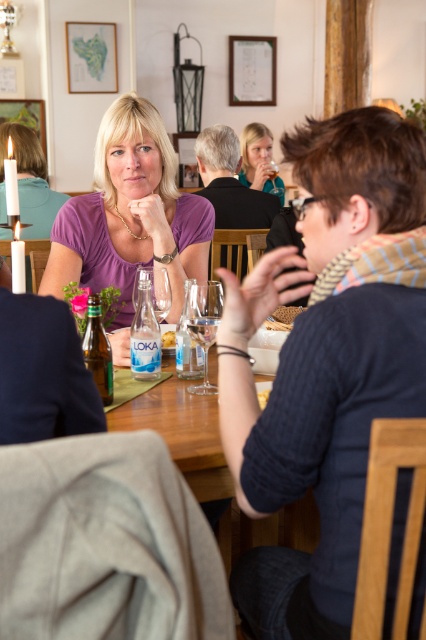
Based on the photo, which of these two, purple matte shirt at upper center or white paper plate at center, stands shorter?

white paper plate at center is shorter.

Where is `purple matte shirt at upper center`? purple matte shirt at upper center is located at coordinates (129, 218).

The width and height of the screenshot is (426, 640). In order to click on purple matte shirt at upper center in this screenshot , I will do pos(129,218).

Who is positioned more to the left, clear plastic bottle at center or crumbly bread at table center?

clear plastic bottle at center is more to the left.

Does clear plastic bottle at center appear over crumbly bread at table center?

Indeed, clear plastic bottle at center is positioned over crumbly bread at table center.

Between point (172, 333) and point (262, 401), which one is positioned behind?

The point (172, 333) is behind.

Locate an element on the screen. This screenshot has height=640, width=426. clear plastic bottle at center is located at coordinates click(175, 339).

In the scene shown: Is the position of transparent glass wine glass at center less distant than that of matte black wine glass at upper center?

Yes, it is in front of matte black wine glass at upper center.

Between point (218, 291) and point (261, 138), which one is positioned behind?

Point (261, 138)

Is point (192, 336) positioned in front of point (264, 186)?

Yes, point (192, 336) is closer to viewer.

Locate an element on the screen. The image size is (426, 640). transparent glass wine glass at center is located at coordinates (204, 324).